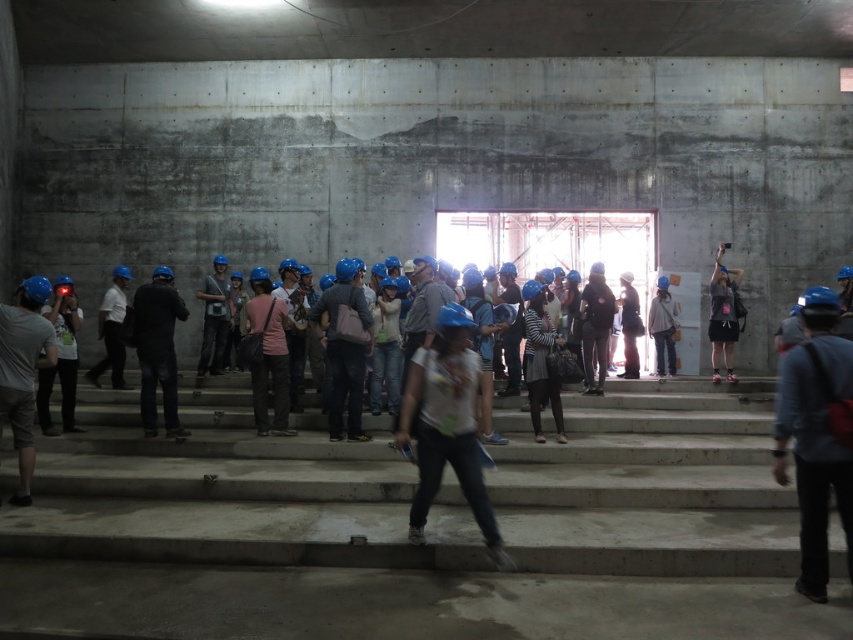
Which is more to the right, white matte t-shirt at center or dark blue jeans at center?

Positioned to the right is white matte t-shirt at center.

Between point (482, 508) and point (172, 356), which one is positioned behind?

The point (172, 356) is behind.

Identify the location of white matte t-shirt at center. This screenshot has width=853, height=640. (447, 426).

Is blue fabric backpack at right taller than matte blue helmet at left?

No, blue fabric backpack at right is not taller than matte blue helmet at left.

Does point (822, 512) come closer to viewer compared to point (26, 476)?

Yes, it is in front of point (26, 476).

The width and height of the screenshot is (853, 640). In order to click on blue fabric backpack at right in this screenshot , I will do `click(815, 435)`.

Which is below, matte blue helmet at center or pink fabric bag at center?

Positioned lower is pink fabric bag at center.

Does matte blue helmet at center have a lesser width compared to pink fabric bag at center?

No, matte blue helmet at center is not thinner than pink fabric bag at center.

Which is behind, point (349, 400) or point (280, 349)?

The point (280, 349) is more distant.

What are the coordinates of `matte blue helmet at center` in the screenshot? It's located at (344, 352).